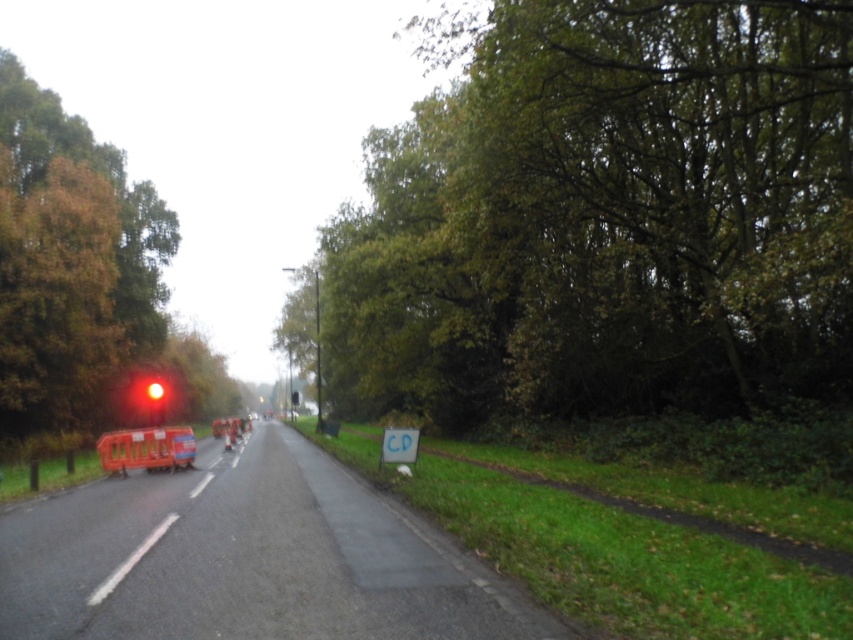
Question: Which point is farther to the camera?

Choices:
 (A) green leafy tree at left
 (B) red glass traffic light at left

Answer: (A)

Question: Is green leafy tree at upper right to the right of green leafy tree at left from the viewer's perspective?

Choices:
 (A) no
 (B) yes

Answer: (B)

Question: In this image, where is green leafy tree at left located relative to red glass traffic light at left?

Choices:
 (A) below
 (B) above

Answer: (B)

Question: Which of the following is the closest to the observer?

Choices:
 (A) red glass traffic light at left
 (B) green leafy tree at left
 (C) brown leafy tree at left

Answer: (C)

Question: Which object appears closest to the camera in this image?

Choices:
 (A) brown leafy tree at left
 (B) red glass traffic light at left
 (C) green leafy tree at left
 (D) green leafy tree at upper right

Answer: (D)

Question: Can you confirm if green leafy tree at upper right is wider than red glass traffic light at left?

Choices:
 (A) no
 (B) yes

Answer: (B)